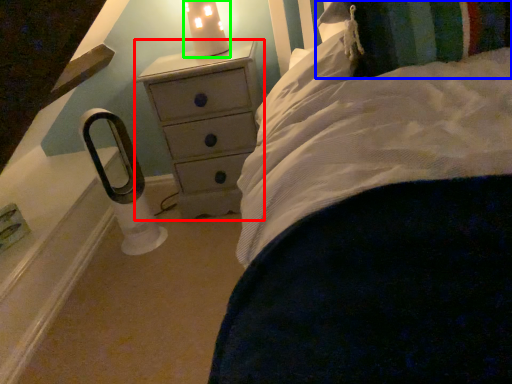
Question: Estimate the real-world distances between objects in this image. Which object is farther from chest of drawers (highlighted by a red box), pillow (highlighted by a blue box) or candle holder (highlighted by a green box)?

Choices:
 (A) pillow
 (B) candle holder

Answer: (A)